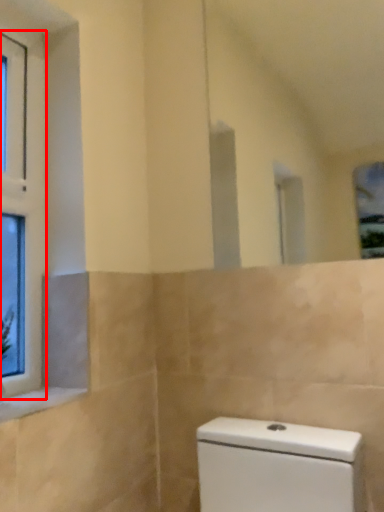
Question: Where is window (annotated by the red box) located in relation to window sill in the image?

Choices:
 (A) left
 (B) right

Answer: (A)